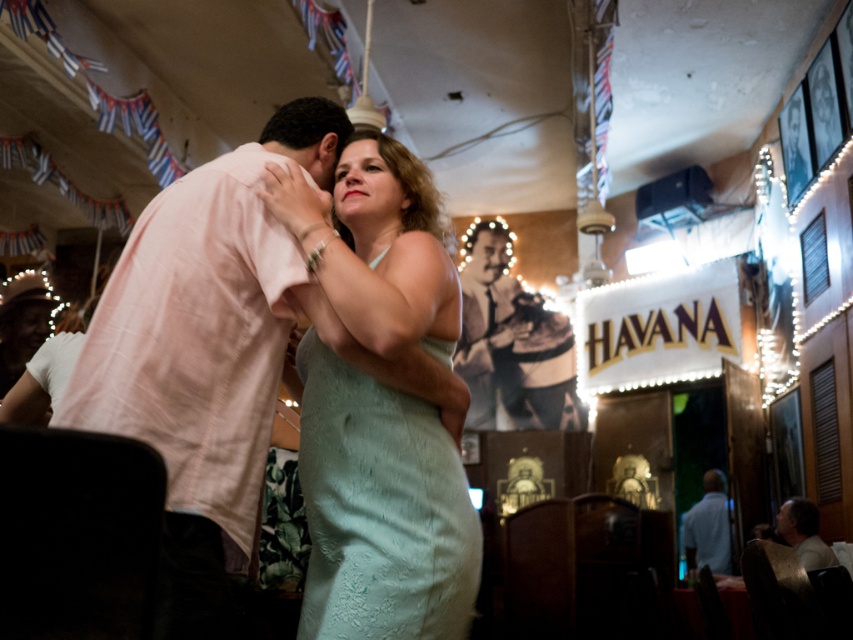
You are standing at the entrance of the HAVANA restaurant and notice two points marked on the ceiling decorations. The first point is at coordinates point (238, 240) and the second is at point (801, 502). Which point is nearer to you?

Point (238, 240) is closer to the viewer than point (801, 502).

You are a photographer standing in the middle of the dance floor. You want to take a photo of the white shirt at lower right and the light brown leather jacket at lower right. Which one should you zoom in on more to capture details, considering their sizes?

The white shirt at lower right is larger than the light brown leather jacket at lower right, so you should zoom in more on the light brown leather jacket at lower right to capture its details properly.